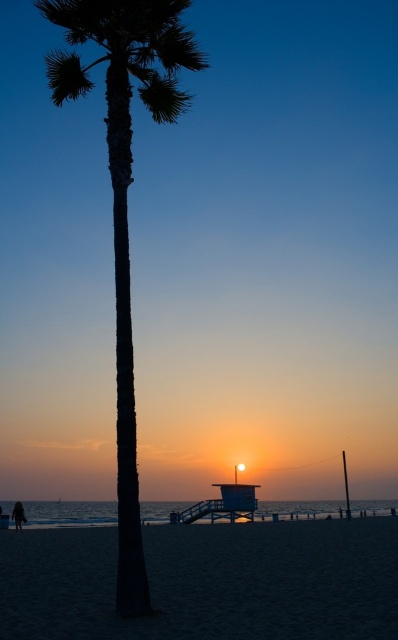
Does sandy beach at lower center have a smaller size compared to dark green textured palm tree at center?

No.

Which is behind, point (245, 531) or point (74, 90)?

Positioned behind is point (245, 531).

This screenshot has height=640, width=398. Find the location of `sandy beach at lower center`. sandy beach at lower center is located at coordinates (206, 580).

Can you confirm if dark green textured palm tree at center is bigger than dark skin person at lower left?

Yes.

Can you confirm if dark green textured palm tree at center is thinner than dark skin person at lower left?

In fact, dark green textured palm tree at center might be wider than dark skin person at lower left.

Find the location of a particular element. The image size is (398, 640). dark green textured palm tree at center is located at coordinates (124, 195).

Who is shorter, sandy beach at lower center or dark skin person at lower left?

With less height is dark skin person at lower left.

Consider the image. Does sandy beach at lower center appear over dark skin person at lower left?

Yes.

Between point (99, 593) and point (19, 531), which one is positioned behind?

The point (19, 531) is behind.

Where is `sandy beach at lower center`? The width and height of the screenshot is (398, 640). sandy beach at lower center is located at coordinates (206, 580).